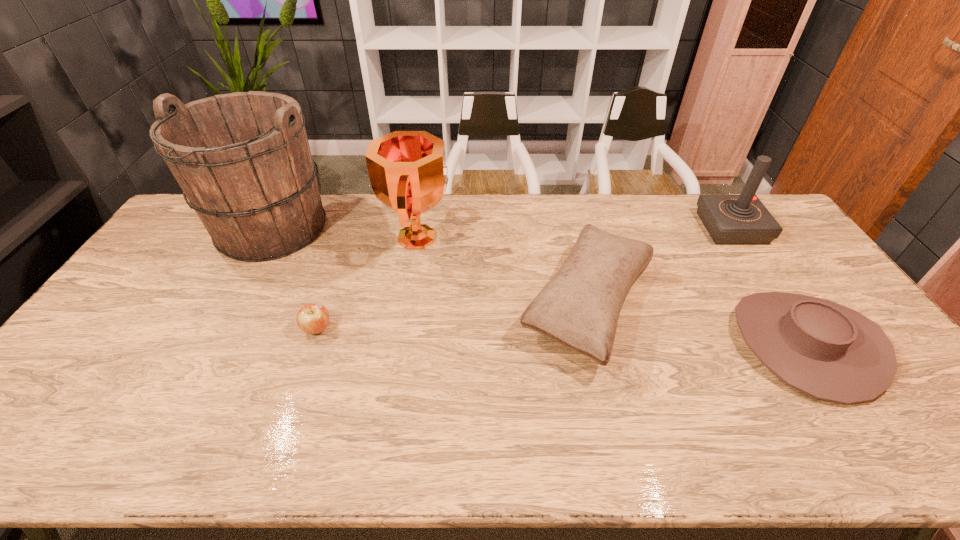
The width and height of the screenshot is (960, 540). Find the location of `vacant space located on the front of the bucket`. vacant space located on the front of the bucket is located at coordinates (236, 292).

This screenshot has height=540, width=960. Find the location of `vacant point located on the side of the fifth shortest object with the star emblem`. vacant point located on the side of the fifth shortest object with the star emblem is located at coordinates (472, 238).

The width and height of the screenshot is (960, 540). I want to click on vacant space located on the rectangular base of the joystick, so click(685, 228).

Locate an element on the screen. This screenshot has height=540, width=960. free space located on the rectangular base of the joystick is located at coordinates (674, 228).

Locate an element on the screen. The width and height of the screenshot is (960, 540). vacant area situated 0.050m on the rectangular base of the joystick is located at coordinates (688, 228).

You are a GUI agent. You are given a task and a screenshot of the screen. Output one action in this format:
    pyautogui.click(x=<x>, y=<y>)
    Task: Click on the free space located on the front of the third object from right to left
    The width and height of the screenshot is (960, 540).
    Given the screenshot: What is the action you would take?
    pyautogui.click(x=624, y=458)

Locate an element on the screen. This screenshot has height=540, width=960. free space located 0.070m on the front of the cowboy hat is located at coordinates tap(865, 435).

Image resolution: width=960 pixels, height=540 pixels. Find the location of `free region located on the back of the shortest object`. free region located on the back of the shortest object is located at coordinates (332, 284).

This screenshot has height=540, width=960. Find the location of `bucket located at the far edge`. bucket located at the far edge is located at coordinates (242, 159).

Where is `award that is at the far edge`? Image resolution: width=960 pixels, height=540 pixels. award that is at the far edge is located at coordinates (408, 173).